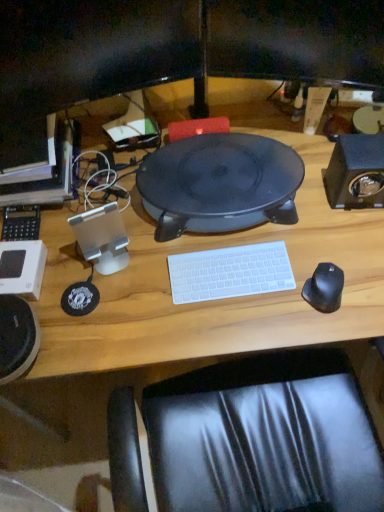
Identify the location of vacant space to the left of black matte speaker at right. The width and height of the screenshot is (384, 512). (302, 207).